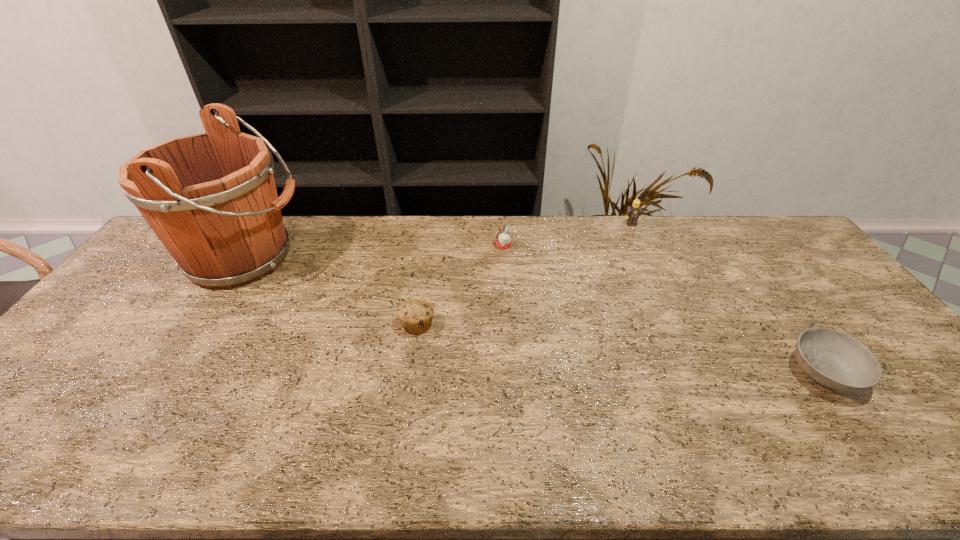
In order to click on vacant space located 0.310m with the handle on the side of the leftmost object in this screenshot , I will do click(403, 258).

The width and height of the screenshot is (960, 540). What are the coordinates of `free space located 0.190m in front of the fourth object from left to right` in the screenshot? It's located at (647, 259).

Find the location of a particular element. free space located on the front-facing side of the right muffin is located at coordinates tap(410, 246).

At what (x,y) coordinates should I click in order to perform the action: click on vacant space located on the front-facing side of the right muffin. Please return your answer as a coordinate pair (x, y). The width and height of the screenshot is (960, 540). Looking at the image, I should click on (390, 246).

Where is `vacant space positioned 0.280m on the front-facing side of the right muffin`? The height and width of the screenshot is (540, 960). vacant space positioned 0.280m on the front-facing side of the right muffin is located at coordinates (413, 246).

The width and height of the screenshot is (960, 540). I want to click on free location located 0.250m on the right of the left muffin, so click(524, 325).

At what (x,y) coordinates should I click in order to perform the action: click on blank space located 0.080m on the front of the bowl. Please return your answer as a coordinate pair (x, y). Image resolution: width=960 pixels, height=540 pixels. Looking at the image, I should click on (870, 436).

The height and width of the screenshot is (540, 960). Find the location of `bucket that is at the far edge`. bucket that is at the far edge is located at coordinates (211, 198).

Where is `Lego present at the far edge`? Lego present at the far edge is located at coordinates (634, 212).

Where is `muffin that is positioned at the far edge`? This screenshot has height=540, width=960. muffin that is positioned at the far edge is located at coordinates (503, 239).